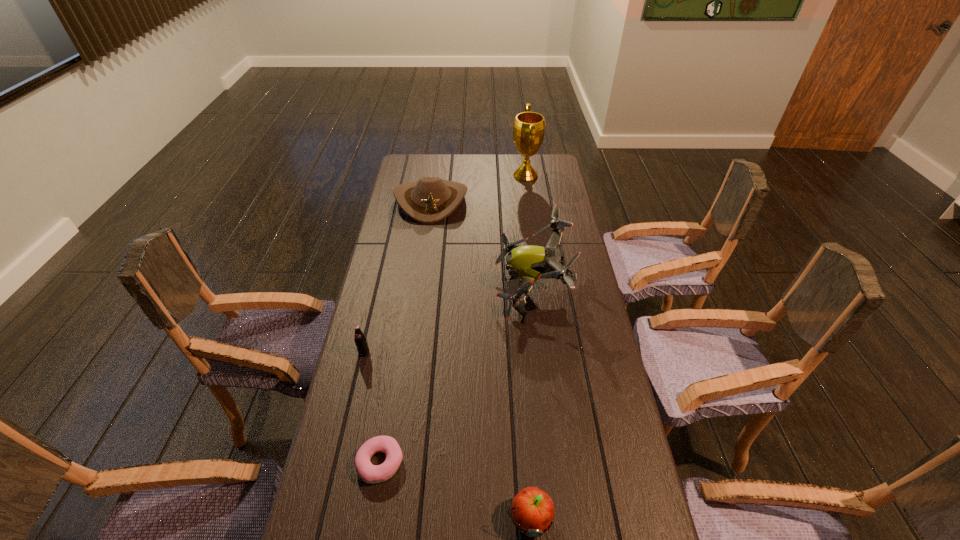
Find the location of a particular element. The image size is (960, 540). pastry that is at the left edge is located at coordinates (370, 473).

Locate an element on the screen. award that is positioned at the right edge is located at coordinates (529, 127).

Identify the location of drone that is positioned at the right edge. (529, 263).

I want to click on object that is positioned at the far left corner, so click(x=430, y=200).

Find the location of a particular element. object that is positioned at the far right corner is located at coordinates (529, 127).

Image resolution: width=960 pixels, height=540 pixels. Identify the location of free location at the far edge. (474, 157).

The width and height of the screenshot is (960, 540). I want to click on free space at the right edge, so click(x=553, y=200).

Locate an element on the screen. free region at the far right corner of the desktop is located at coordinates (556, 163).

The height and width of the screenshot is (540, 960). What are the coordinates of `free space between the tallest object and the pop` in the screenshot? It's located at (444, 264).

This screenshot has width=960, height=540. What are the coordinates of `free space between the shortest object and the drone` in the screenshot? It's located at (456, 375).